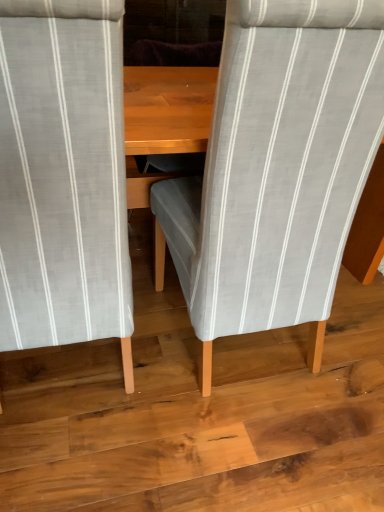
The height and width of the screenshot is (512, 384). In order to click on vacant space situated above wooden floor at center (from a real-world perspective) in this screenshot , I will do `click(222, 386)`.